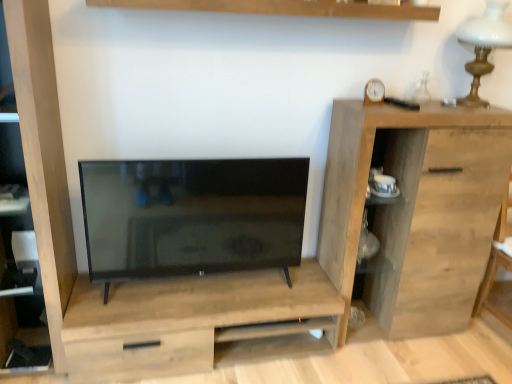
Image resolution: width=512 pixels, height=384 pixels. I want to click on free space above light wood dresser at center (from a real-world perspective), so click(x=204, y=291).